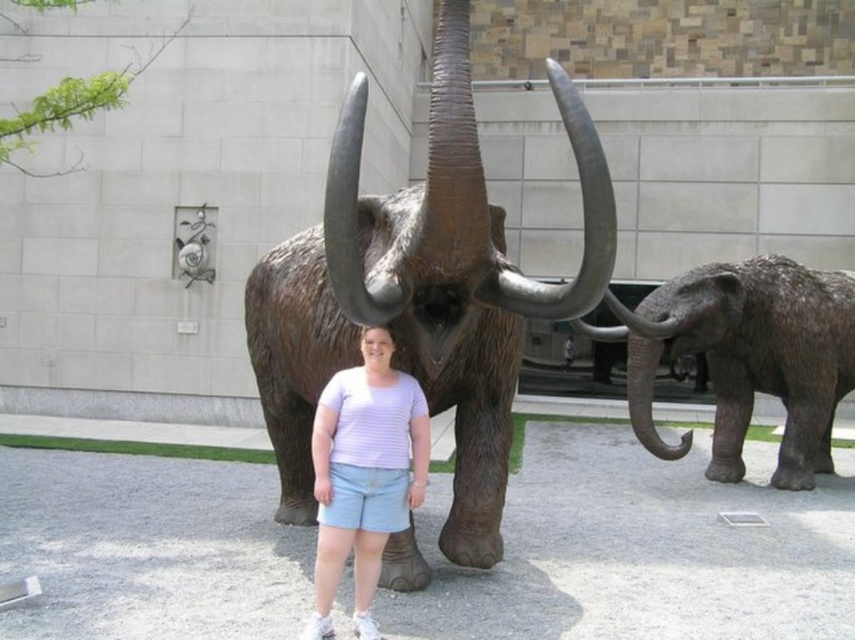
Question: Which of the following is the farthest from the observer?

Choices:
 (A) (677, 445)
 (B) (345, 378)

Answer: (A)

Question: Does bronze statue of mammoth at center have a larger size compared to rough textured gray elephant at right?

Choices:
 (A) no
 (B) yes

Answer: (A)

Question: Among these points, which one is nearest to the camera?

Choices:
 (A) (404, 380)
 (B) (789, 280)

Answer: (A)

Question: Observing the image, what is the correct spatial positioning of bronze statue of mammoth at center in reference to white striped shirt at center?

Choices:
 (A) above
 (B) below

Answer: (A)

Question: Which point is farther to the camera?

Choices:
 (A) pyautogui.click(x=335, y=483)
 (B) pyautogui.click(x=452, y=218)

Answer: (A)

Question: Can you confirm if bronze statue of mammoth at center is thinner than rough textured gray elephant at right?

Choices:
 (A) yes
 (B) no

Answer: (A)